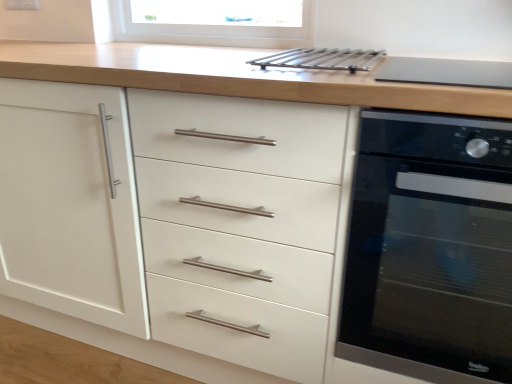
Where is `vacant region under metallic silver rack at upper center (from a real-world perspective)`? vacant region under metallic silver rack at upper center (from a real-world perspective) is located at coordinates point(324,54).